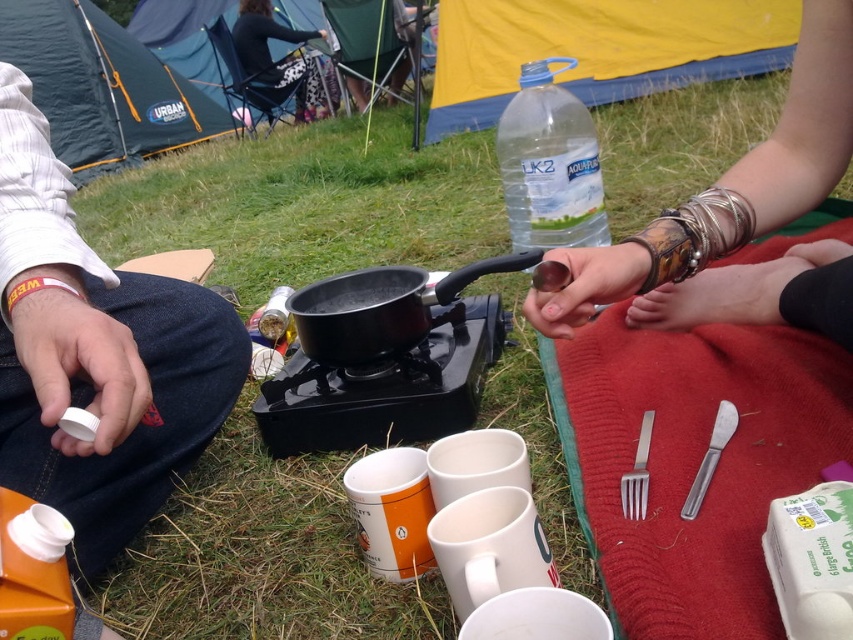
Question: Among these points, which one is farthest from the camera?

Choices:
 (A) tap(792, 452)
 (B) tap(523, 161)
 (C) tap(775, 45)
 (D) tap(91, 26)

Answer: (D)

Question: Based on their relative distances, which object is nearer to the red woolen blanket at lower right?

Choices:
 (A) yellow fabric tent at upper center
 (B) clear plastic bottle at upper center
 (C) leather bracelet at upper center
 (D) black matte frying pan at center

Answer: (C)

Question: Which point is closer to the camera taking this photo?

Choices:
 (A) (431, 285)
 (B) (769, 35)

Answer: (A)

Question: Can you confirm if yellow fabric tent at upper center is bigger than clear plastic bottle at upper center?

Choices:
 (A) no
 (B) yes

Answer: (B)

Question: In this image, where is red woolen blanket at lower right located relative to blue fabric tent at upper left?

Choices:
 (A) above
 (B) below

Answer: (B)

Question: Considering the relative positions of red woolen blanket at lower right and dark green fabric tent at upper left in the image provided, where is red woolen blanket at lower right located with respect to dark green fabric tent at upper left?

Choices:
 (A) left
 (B) right

Answer: (B)